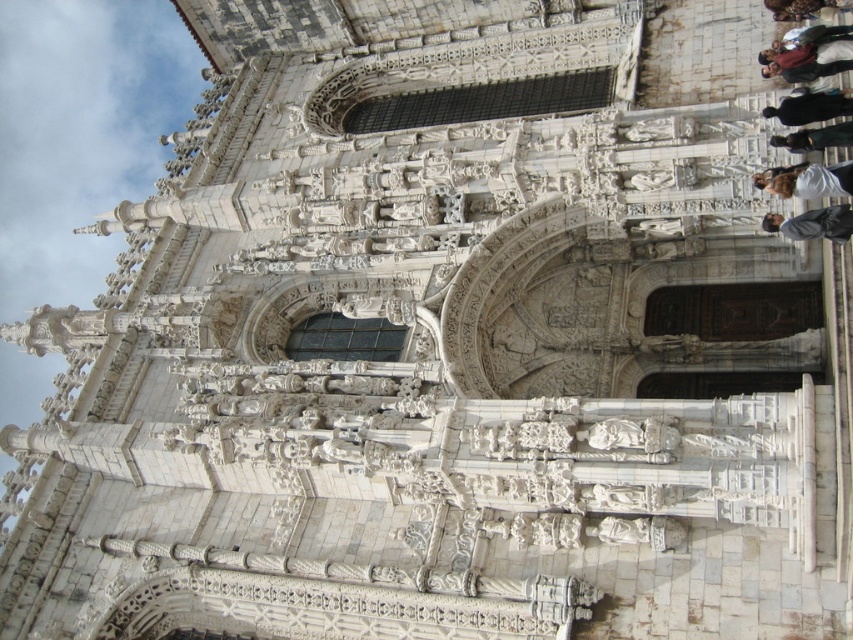
Is white fabric at upper right positioned before dark brown leather jacket at upper right?

Yes, it is in front of dark brown leather jacket at upper right.

Who is higher up, white fabric at upper right or dark brown leather jacket at upper right?

Positioned higher is dark brown leather jacket at upper right.

Find the location of `white fabric at upper right`. white fabric at upper right is located at coordinates (807, 180).

Does white fabric at upper right lie behind dark gray suit at center?

That is True.

Between white fabric at upper right and dark gray suit at center, which one is positioned lower?

dark gray suit at center

Identify the location of white fabric at upper right. The image size is (853, 640). (807, 180).

Which is behind, point (817, 113) or point (833, 138)?

The point (817, 113) is more distant.

Who is taller, black fabric person at upper right or black leather jacket at upper right?

With more height is black fabric person at upper right.

Between point (804, 113) and point (824, 131), which one is positioned behind?

Positioned behind is point (804, 113).

Where is `black fabric person at upper right`? The image size is (853, 640). black fabric person at upper right is located at coordinates (810, 108).